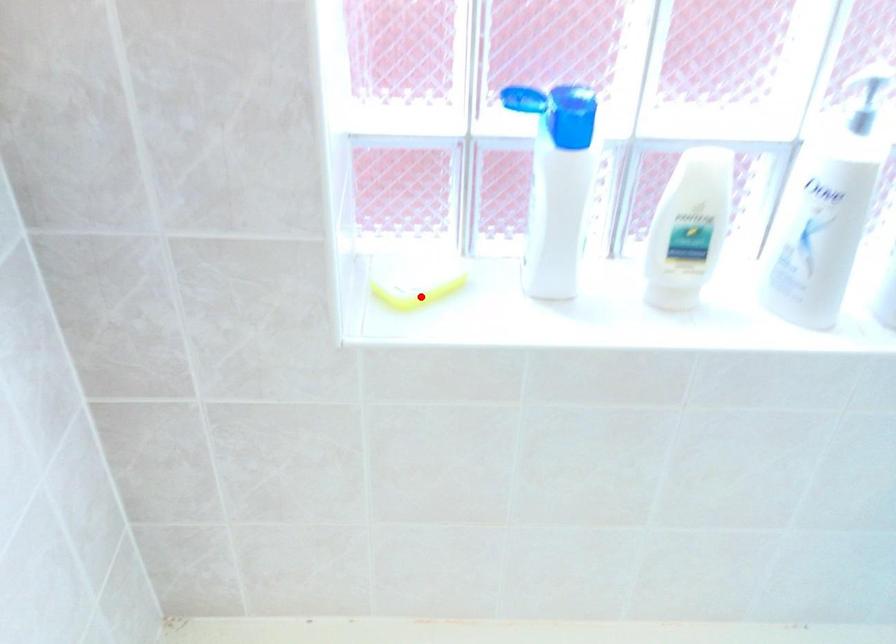
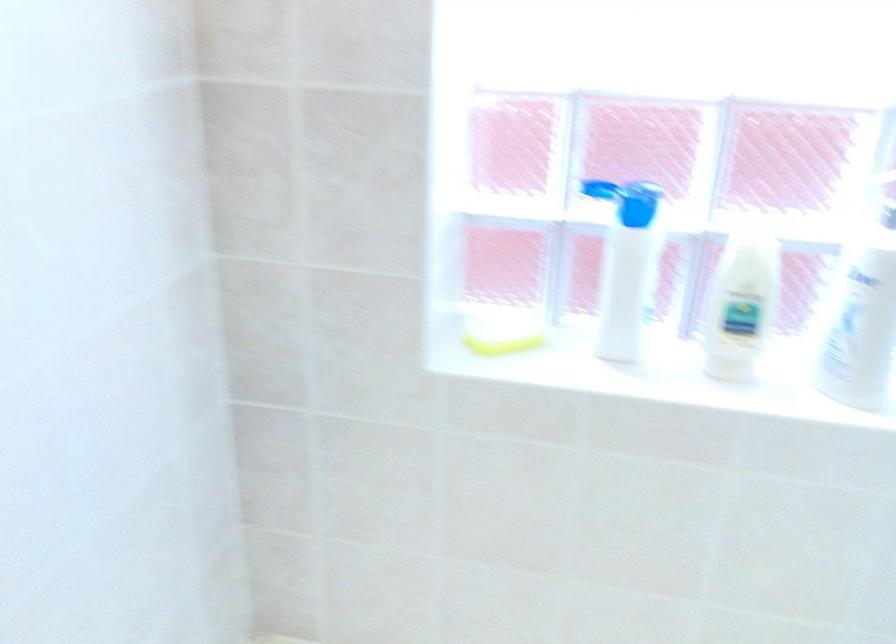
Where in the second image is the point corresponding to the highlighted location from the first image?

(503, 344)